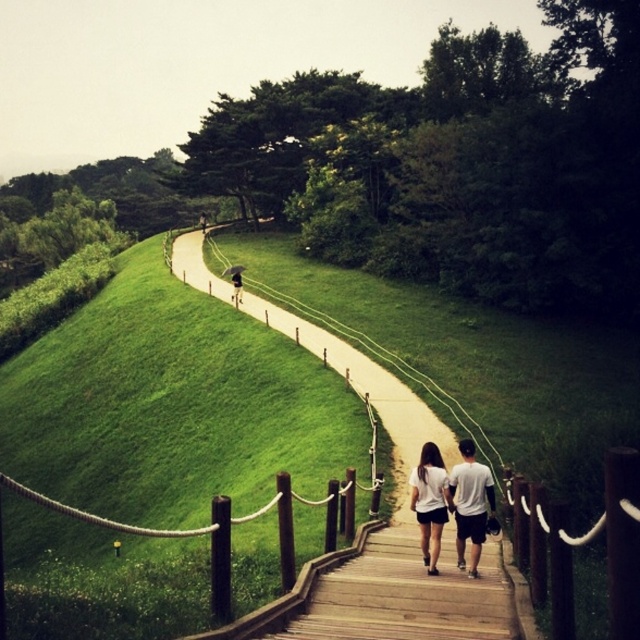
You are a GUI agent. You are given a task and a screenshot of the screen. Output one action in this format:
    pyautogui.click(x=<x>, y=<y>)
    Task: Click on the green grassy hillside at upper left
    
    Given the screenshot: What is the action you would take?
    pyautogui.click(x=163, y=460)

Is point (189, 492) more distant than point (432, 461)?

Yes.

The image size is (640, 640). What are the coordinates of `green grassy hillside at upper left` in the screenshot? It's located at (163, 460).

Is point (413, 461) positioned behind point (232, 285)?

That is False.

Does wooden pathway at center appear over dark blue jeans at center?

No.

Describe the element at coordinates (397, 531) in the screenshot. The image size is (640, 640). I see `wooden pathway at center` at that location.

The width and height of the screenshot is (640, 640). Identify the location of wooden pathway at center. (397, 531).

Who is lower down, green grassy hillside at upper left or wooden pathway at center?

Positioned lower is green grassy hillside at upper left.

The image size is (640, 640). I want to click on green grassy hillside at upper left, so click(163, 460).